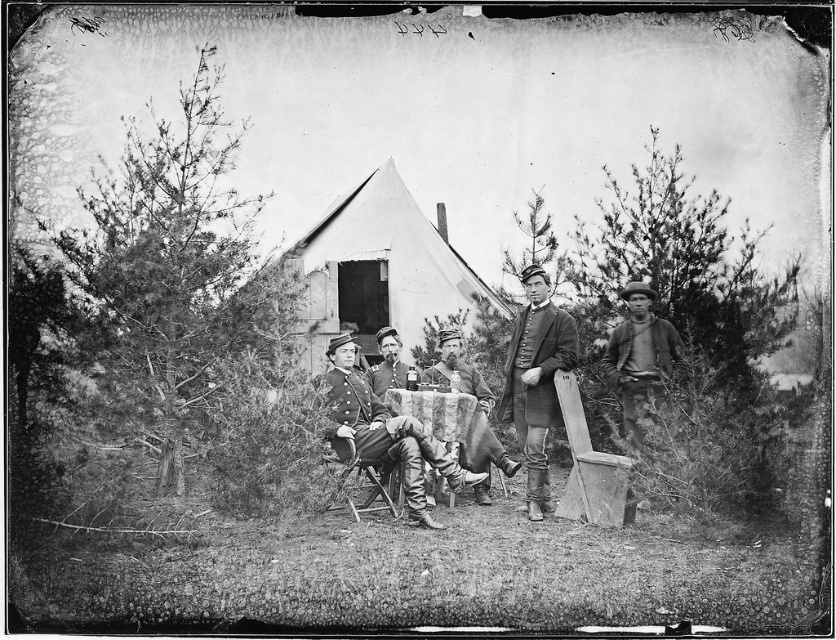
Consider the image. You are a soldier in the scene and want to sit down. You see the rugged brown shirt at right and the rustic wood chair at center. Which object can you sit on?

The rustic wood chair at center is the object you can sit on. The rugged brown shirt at right is positioned over it, but the chair itself is meant for sitting.

You are a soldier in the Civil War era standing in front of the white canvas tent at center and the smooth leather hat at center. Which object is nearer to you?

The white canvas tent at center is closer to you than the smooth leather hat at center.